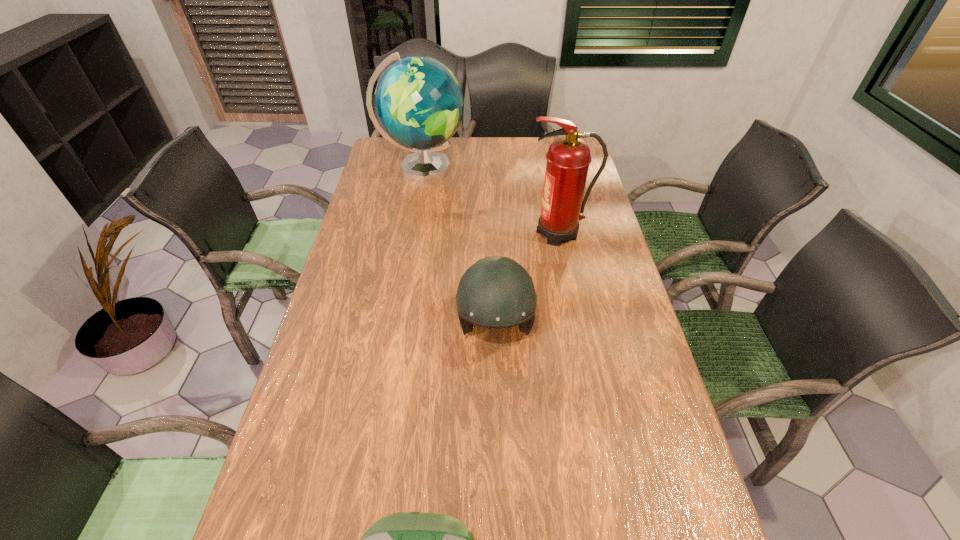
What are the coordinates of `object that is at the left edge` in the screenshot? It's located at (419, 104).

Where is `object that is at the right edge`? object that is at the right edge is located at coordinates (568, 158).

Image resolution: width=960 pixels, height=540 pixels. Find the location of `object present at the far left corner`. object present at the far left corner is located at coordinates (419, 104).

The height and width of the screenshot is (540, 960). In order to click on free location at the far edge in this screenshot , I will do `click(490, 166)`.

The image size is (960, 540). I want to click on vacant point at the left edge, so click(x=294, y=491).

You are a GUI agent. You are given a task and a screenshot of the screen. Output one action in this format:
    pyautogui.click(x=<x>, y=<y>)
    Task: Click on the free space at the right edge
    
    Given the screenshot: What is the action you would take?
    pyautogui.click(x=590, y=246)

At what (x,y) coordinates should I click in order to perform the action: click on the closest object to the farther football helmet. Please return your answer as a coordinate pair (x, y). Looking at the image, I should click on (568, 158).

Image resolution: width=960 pixels, height=540 pixels. Identify the location of object that can be found as the closest to the globe. (568, 158).